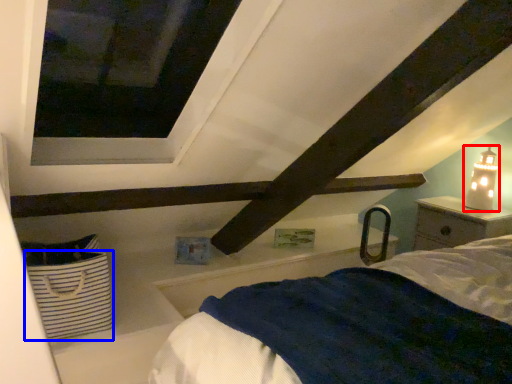
Question: Among these objects, which one is farthest to the camera, table lamp (highlighted by a red box) or basket (highlighted by a blue box)?

Choices:
 (A) table lamp
 (B) basket

Answer: (A)